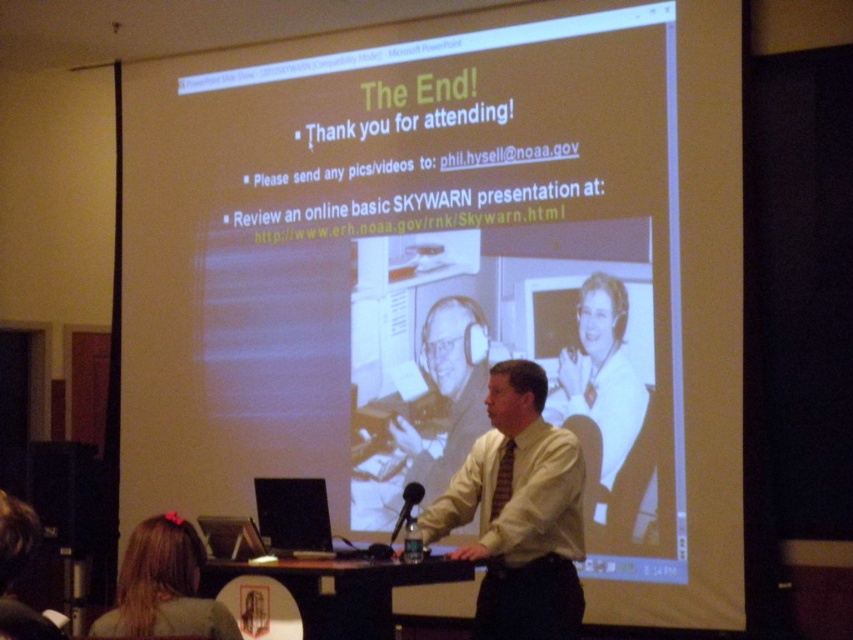
Is brown hair at lower left thinner than black plastic microphone at center?

No.

Can you confirm if brown hair at lower left is bigger than black plastic microphone at center?

Yes.

Where is `brown hair at lower left`? brown hair at lower left is located at coordinates (x=163, y=586).

The height and width of the screenshot is (640, 853). Find the location of `brown hair at lower left`. brown hair at lower left is located at coordinates coord(163,586).

Between brown hair at lower left and white matte headphones at center, which one is positioned lower?

Positioned lower is brown hair at lower left.

Can you confirm if brown hair at lower left is bigger than white matte headphones at center?

No.

Does point (154, 560) lie in front of point (450, 403)?

Yes, it is.

You are a GUI agent. You are given a task and a screenshot of the screen. Output one action in this format:
    pyautogui.click(x=<x>, y=<y>)
    Task: Click on the brown hair at lower left
    This screenshot has width=853, height=640.
    Given the screenshot: What is the action you would take?
    pyautogui.click(x=163, y=586)

Between point (618, 390) and point (451, 372), which one is positioned in front?

Positioned in front is point (618, 390).

Between white glossy shirt at center and white matte headphones at center, which one has more height?

white glossy shirt at center is taller.

Where is `white glossy shirt at center`? The image size is (853, 640). white glossy shirt at center is located at coordinates (598, 371).